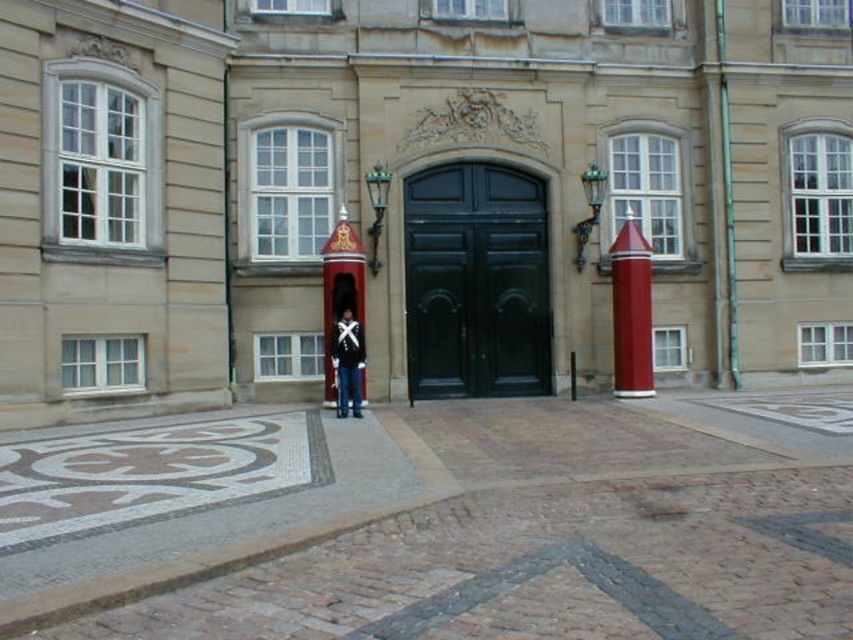
Is smooth red pillar at center right above uniformed man at center?

Correct, smooth red pillar at center right is located above uniformed man at center.

Who is positioned more to the right, smooth red pillar at center right or uniformed man at center?

smooth red pillar at center right

Between point (633, 228) and point (349, 348), which one is positioned behind?

The point (633, 228) is behind.

Find the location of a particular element. smooth red pillar at center right is located at coordinates (631, 312).

Looking at this image, is green polished wood door at center wider than uniformed man at center?

Yes.

Is green polished wood door at center positioned behind uniformed man at center?

Yes, it is.

Is point (482, 230) more distant than point (357, 410)?

That is True.

The height and width of the screenshot is (640, 853). I want to click on green polished wood door at center, so click(x=476, y=282).

Does green polished wood door at center appear on the right side of smooth red pillar at center right?

In fact, green polished wood door at center is to the left of smooth red pillar at center right.

What do you see at coordinates (476, 282) in the screenshot? I see `green polished wood door at center` at bounding box center [476, 282].

In the scene shown: Measure the distance between point (492, 333) and camera.

Point (492, 333) is 61.65 feet from camera.

Locate an element on the screen. This screenshot has width=853, height=640. green polished wood door at center is located at coordinates (476, 282).